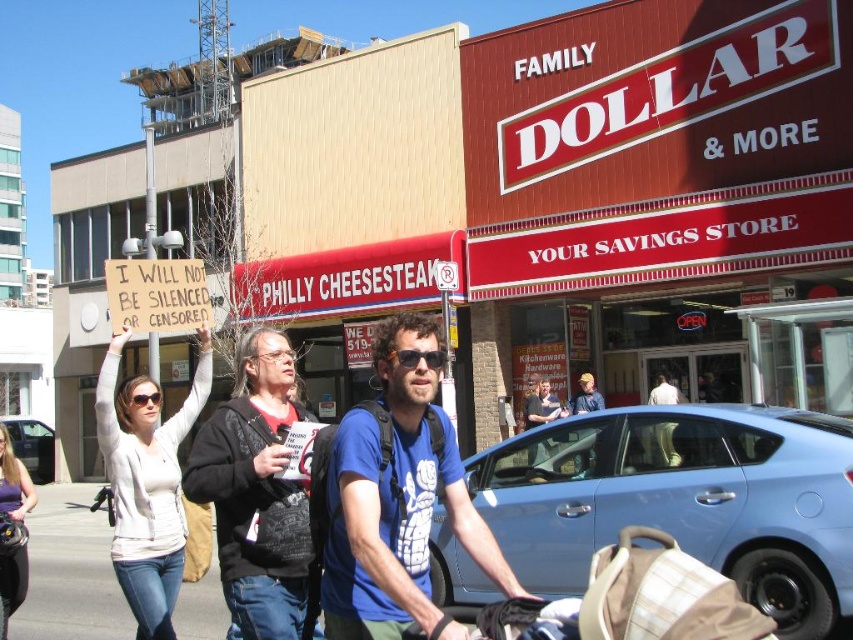
Question: Can you confirm if white sweater at center is smaller than metallic blue sedan at center?

Choices:
 (A) yes
 (B) no

Answer: (A)

Question: Which point is farther from the camera taking this photo?

Choices:
 (A) (276, 493)
 (B) (345, 424)
 (C) (761, 513)

Answer: (C)

Question: Does blue matte car at lower right appear under white cotton shirt at center?

Choices:
 (A) no
 (B) yes

Answer: (B)

Question: Which object is farther from the camera taking this photo?

Choices:
 (A) dark gray hoodie at center
 (B) blue matte car at lower right
 (C) blue t-shirt at center
 (D) white sweater at center

Answer: (D)

Question: Considering the relative positions of white sweater at center and plaid fabric baby carriage at lower center in the image provided, where is white sweater at center located with respect to plaid fabric baby carriage at lower center?

Choices:
 (A) right
 (B) left

Answer: (B)

Question: Among these objects, which one is nearest to the camera?

Choices:
 (A) metallic blue sedan at center
 (B) white sweater at center
 (C) blue t-shirt at center

Answer: (C)